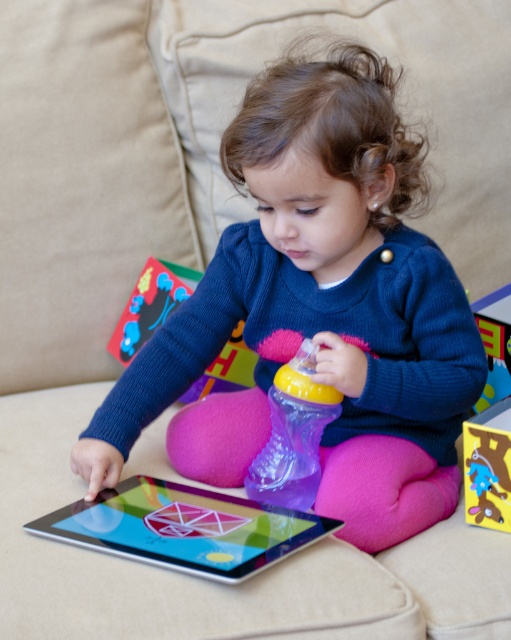
Consider the image. You are a parent trying to choose between the matte plastic tablet at center and the rubberized plastic toy at left for your child. Considering their sizes, which one is more suitable for a younger child who is still developing fine motor skills?

The matte plastic tablet at center is smaller than the rubberized plastic toy at left. Since younger children with developing fine motor skills may find smaller objects harder to grasp, the rubberized plastic toy at left is more suitable due to its larger size, making it easier to handle.

You are a designer creating a virtual 3D model of the scene. To place the matte blue sweater at center correctly in the 3D space, which coordinate point should you use?

The matte blue sweater at center is located at point (317, 308), so you should use that coordinate point to place it correctly in the 3D model.

You are a parent organizing the toy box and need to place the transparent plastic bottle at center and the plush blue toy at center inside. Since the toy box has limited vertical space, which object should you place first to ensure both fit properly?

The plush blue toy at center should be placed first because the transparent plastic bottle at center is much taller, so placing the taller bottle last allows you to adjust its position without displacing the shorter toy.